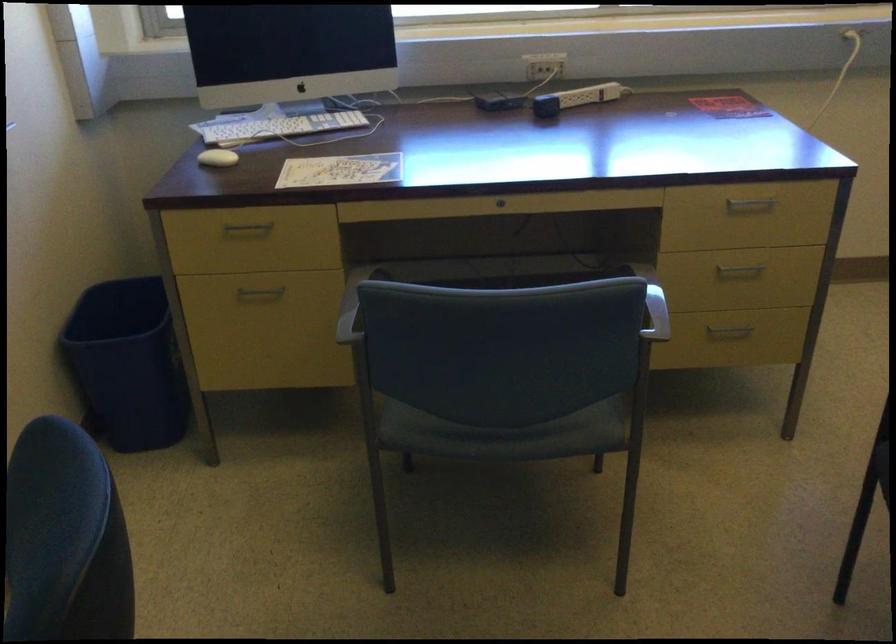
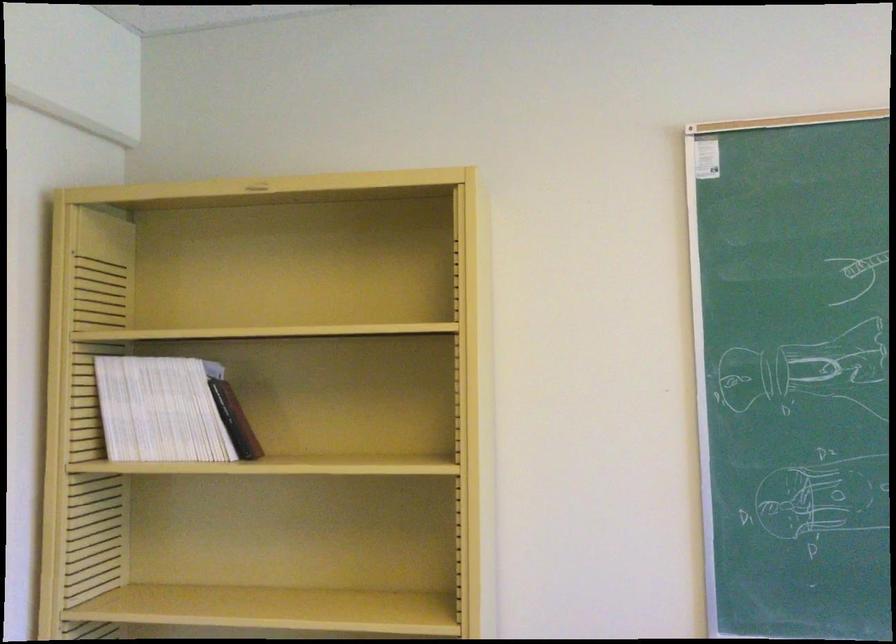
Question: The camera is either moving clockwise (left) or counter-clockwise (right) around the object. The first image is from the beginning of the video and the second image is from the end. Is the camera moving left or right when shooting the video?

Choices:
 (A) Left
 (B) Right

Answer: (B)